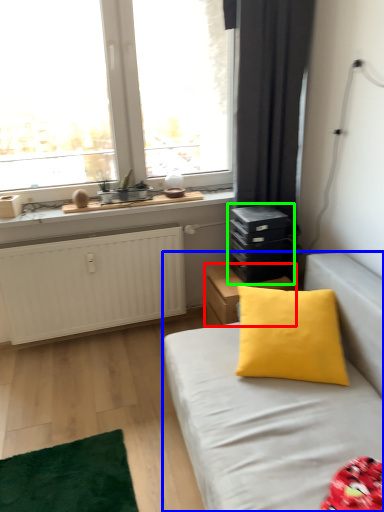
Question: Considering the real-world distances, which object is farthest from nightstand (highlighted by a red box)? studio couch (highlighted by a blue box) or dresser (highlighted by a green box)?

Choices:
 (A) studio couch
 (B) dresser

Answer: (A)